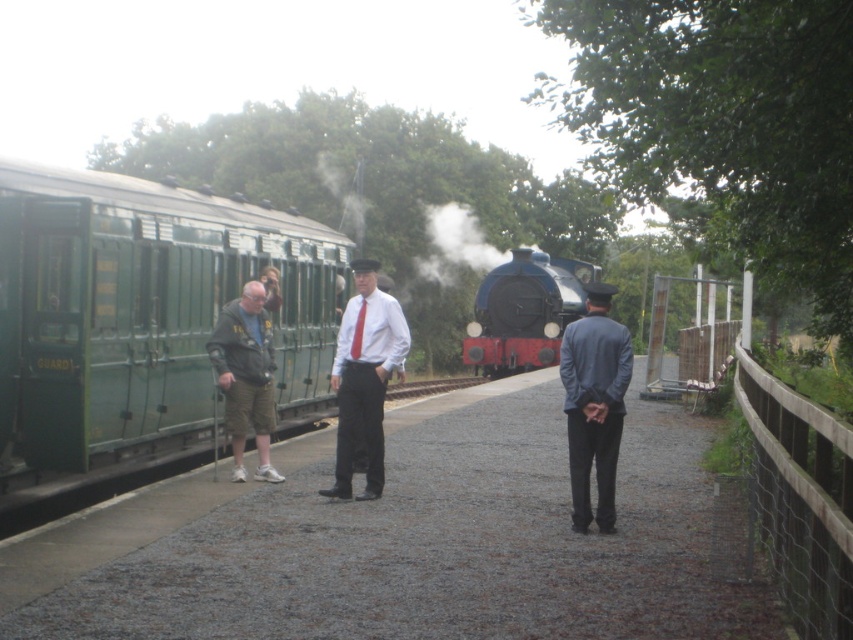
Does green painted metal train car at left have a larger size compared to dark blue suit at center?

Actually, green painted metal train car at left might be smaller than dark blue suit at center.

Is green painted metal train car at left taller than dark blue suit at center?

Correct, green painted metal train car at left is much taller as dark blue suit at center.

What are the coordinates of `green painted metal train car at left` in the screenshot? It's located at (141, 314).

Does point (573, 406) come behind point (538, 256)?

That is False.

Does dark blue suit at center have a smaller size compared to shiny blue locomotive at center?

No, dark blue suit at center is not smaller than shiny blue locomotive at center.

The height and width of the screenshot is (640, 853). What do you see at coordinates (595, 403) in the screenshot?
I see `dark blue suit at center` at bounding box center [595, 403].

The height and width of the screenshot is (640, 853). I want to click on dark blue suit at center, so click(x=595, y=403).

Is dark blue suit at center to the right of white smoke at center from the viewer's perspective?

Indeed, dark blue suit at center is positioned on the right side of white smoke at center.

Does dark blue suit at center lie in front of white smoke at center?

Yes, it is in front of white smoke at center.

Locate an element on the screen. This screenshot has height=640, width=853. dark blue suit at center is located at coordinates (595, 403).

Where is `dark blue suit at center`? Image resolution: width=853 pixels, height=640 pixels. dark blue suit at center is located at coordinates (595, 403).